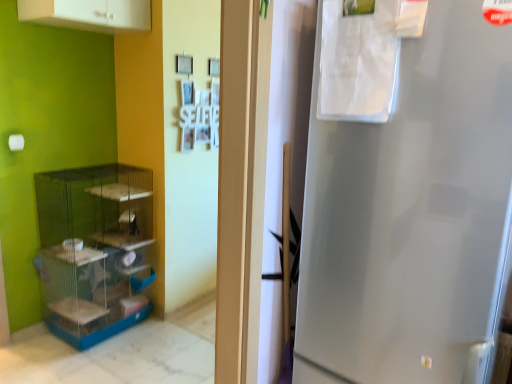
Question: Is blue plastic shelf at left inside the boundaries of white matte cabinet at upper left, or outside?

Choices:
 (A) inside
 (B) outside

Answer: (B)

Question: Considering the positions of blue plastic shelf at left and white matte cabinet at upper left in the image, is blue plastic shelf at left taller or shorter than white matte cabinet at upper left?

Choices:
 (A) short
 (B) tall

Answer: (B)

Question: Considering the positions of point (105, 178) and point (147, 18), is point (105, 178) closer or farther from the camera than point (147, 18)?

Choices:
 (A) farther
 (B) closer

Answer: (A)

Question: Does point (126, 19) appear closer or farther from the camera than point (95, 269)?

Choices:
 (A) closer
 (B) farther

Answer: (A)

Question: Which is correct: white matte cabinet at upper left is inside blue plastic shelf at left, or outside of it?

Choices:
 (A) outside
 (B) inside

Answer: (A)

Question: From a real-world perspective, is white matte cabinet at upper left above or below blue plastic shelf at left?

Choices:
 (A) below
 (B) above

Answer: (B)

Question: From their relative heights in the image, would you say white matte cabinet at upper left is taller or shorter than blue plastic shelf at left?

Choices:
 (A) tall
 (B) short

Answer: (B)